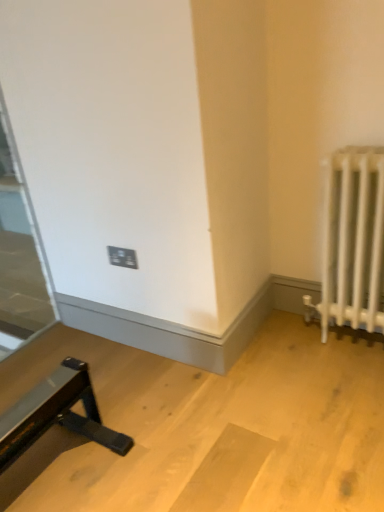
Question: Does black plastic outlet at center appear on the right side of transparent glass door at left?

Choices:
 (A) no
 (B) yes

Answer: (B)

Question: From the image's perspective, is black plastic outlet at center above transparent glass door at left?

Choices:
 (A) no
 (B) yes

Answer: (A)

Question: Does black plastic outlet at center have a greater height compared to transparent glass door at left?

Choices:
 (A) yes
 (B) no

Answer: (B)

Question: Is black plastic outlet at center shorter than transparent glass door at left?

Choices:
 (A) no
 (B) yes

Answer: (B)

Question: Is black plastic outlet at center placed right next to transparent glass door at left?

Choices:
 (A) no
 (B) yes

Answer: (A)

Question: Is transparent glass door at left to the left or to the right of white metal radiator at right in the image?

Choices:
 (A) right
 (B) left

Answer: (B)

Question: In the image, is transparent glass door at left positioned in front of or behind white metal radiator at right?

Choices:
 (A) front
 (B) behind

Answer: (B)

Question: From the image's perspective, is transparent glass door at left positioned above or below white metal radiator at right?

Choices:
 (A) above
 (B) below

Answer: (A)

Question: Is transparent glass door at left taller or shorter than white metal radiator at right?

Choices:
 (A) tall
 (B) short

Answer: (A)

Question: Considering the relative positions of black plastic outlet at center and transparent glass door at left in the image provided, is black plastic outlet at center to the left or to the right of transparent glass door at left?

Choices:
 (A) left
 (B) right

Answer: (B)

Question: In terms of height, does black plastic outlet at center look taller or shorter compared to transparent glass door at left?

Choices:
 (A) tall
 (B) short

Answer: (B)

Question: Considering their positions, is black plastic outlet at center located in front of or behind transparent glass door at left?

Choices:
 (A) behind
 (B) front

Answer: (A)

Question: Which is correct: black plastic outlet at center is inside transparent glass door at left, or outside of it?

Choices:
 (A) inside
 (B) outside

Answer: (B)

Question: From a real-world perspective, is transparent glass door at left above or below black plastic outlet at center?

Choices:
 (A) above
 (B) below

Answer: (A)

Question: Visually, is transparent glass door at left positioned to the left or to the right of black plastic outlet at center?

Choices:
 (A) right
 (B) left

Answer: (B)